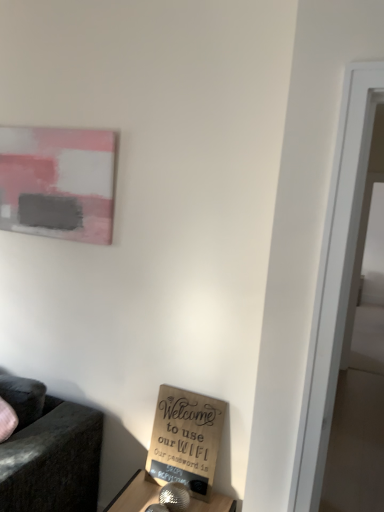
Based on the photo, what is the approximate width of matte pink painting at upper left?

It is 4.06 centimeters.

Where is `matte pink painting at upper left`? matte pink painting at upper left is located at coordinates click(x=57, y=182).

Measure the distance between matte pink painting at upper left and camera.

They are 1.83 meters apart.

Describe the element at coordinates (57, 182) in the screenshot. The height and width of the screenshot is (512, 384). I see `matte pink painting at upper left` at that location.

What do you see at coordinates (185, 440) in the screenshot?
I see `burlap sign at lower center` at bounding box center [185, 440].

At what (x,y) coordinates should I click in order to perform the action: click on burlap sign at lower center. Please return your answer as a coordinate pair (x, y). This screenshot has height=512, width=384. Looking at the image, I should click on (185, 440).

Image resolution: width=384 pixels, height=512 pixels. What are the coordinates of `matte pink painting at upper left` in the screenshot? It's located at (57, 182).

Based on their positions, is burlap sign at lower center located to the left or right of matte pink painting at upper left?

Based on their positions, burlap sign at lower center is located to the right of matte pink painting at upper left.

Does burlap sign at lower center lie behind matte pink painting at upper left?

A: No, burlap sign at lower center is in front of matte pink painting at upper left.

Does point (219, 406) come behind point (85, 130)?

No.

From the image's perspective, which one is positioned lower, burlap sign at lower center or matte pink painting at upper left?

burlap sign at lower center is shown below in the image.

From the picture: From a real-world perspective, which object stands above the other?

matte pink painting at upper left.

Considering the sizes of objects burlap sign at lower center and matte pink painting at upper left in the image provided, who is wider, burlap sign at lower center or matte pink painting at upper left?

burlap sign at lower center is wider.

Considering the sizes of objects burlap sign at lower center and matte pink painting at upper left in the image provided, who is taller, burlap sign at lower center or matte pink painting at upper left?

matte pink painting at upper left is taller.

Considering the sizes of objects burlap sign at lower center and matte pink painting at upper left in the image provided, who is bigger, burlap sign at lower center or matte pink painting at upper left?

Bigger between the two is matte pink painting at upper left.

Is burlap sign at lower center not within matte pink painting at upper left?

That's correct, burlap sign at lower center is outside of matte pink painting at upper left.

Is burlap sign at lower center directly adjacent to matte pink painting at upper left?

They are not placed beside each other.

Does burlap sign at lower center turn towards matte pink painting at upper left?

No, burlap sign at lower center is not oriented towards matte pink painting at upper left.

The width and height of the screenshot is (384, 512). In the image, there is a matte pink painting at upper left. Identify the location of cardboard box below it (from the image's perspective). (185, 440).

Can you confirm if matte pink painting at upper left is positioned to the left of burlap sign at lower center?

Yes, matte pink painting at upper left is to the left of burlap sign at lower center.

Who is more distant, matte pink painting at upper left or burlap sign at lower center?

matte pink painting at upper left.

Which is closer to the camera, (x=10, y=141) or (x=186, y=417)?

Point (x=10, y=141) is positioned farther from the camera compared to point (x=186, y=417).

From the image's perspective, is matte pink painting at upper left above or below burlap sign at lower center?

matte pink painting at upper left is situated higher than burlap sign at lower center in the image.

From a real-world perspective, is matte pink painting at upper left above or below burlap sign at lower center?

In terms of real-world spatial position, matte pink painting at upper left is above burlap sign at lower center.

Considering the sizes of objects matte pink painting at upper left and burlap sign at lower center in the image provided, who is wider, matte pink painting at upper left or burlap sign at lower center?

With larger width is burlap sign at lower center.

In the scene shown: Is matte pink painting at upper left shorter than burlap sign at lower center?

No.

Who is bigger, matte pink painting at upper left or burlap sign at lower center?

matte pink painting at upper left is bigger.

Would you say matte pink painting at upper left contains burlap sign at lower center?

No, burlap sign at lower center is not surrounded by matte pink painting at upper left.

Is the surface of matte pink painting at upper left in direct contact with burlap sign at lower center?

No, matte pink painting at upper left is not next to burlap sign at lower center.

Is matte pink painting at upper left facing towards burlap sign at lower center?

No, matte pink painting at upper left is not turned towards burlap sign at lower center.

Can you tell me how much matte pink painting at upper left and burlap sign at lower center differ in facing direction?

The angular difference between matte pink painting at upper left and burlap sign at lower center is 0.0197 degrees.

Measure the distance between matte pink painting at upper left and burlap sign at lower center.

A distance of 38.93 inches exists between matte pink painting at upper left and burlap sign at lower center.

Identify the location of cardboard box below the matte pink painting at upper left (from the image's perspective). The width and height of the screenshot is (384, 512). (185, 440).

Identify the location of cardboard box below the matte pink painting at upper left (from a real-world perspective). This screenshot has width=384, height=512. (185, 440).

Where is `cardboard box in front of the matte pink painting at upper left`? cardboard box in front of the matte pink painting at upper left is located at coordinates (185, 440).